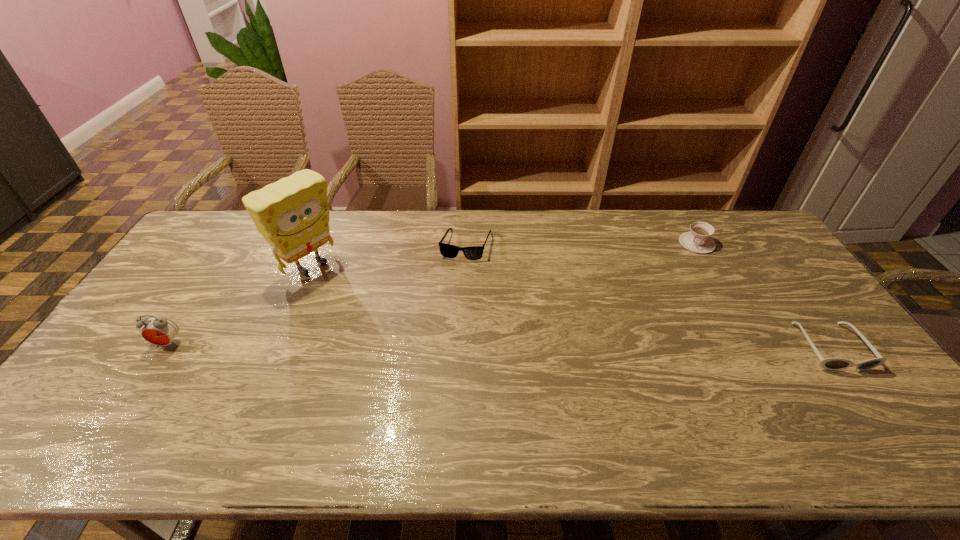
In order to click on object that can be found as the second closest to the farther sunglasses in this screenshot , I will do `click(698, 240)`.